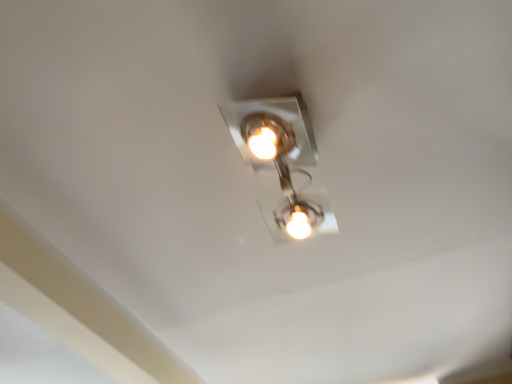
What do you see at coordinates (282, 162) in the screenshot? The image size is (512, 384). I see `matte silver lamp at center` at bounding box center [282, 162].

Image resolution: width=512 pixels, height=384 pixels. Find the location of `matte silver lamp at center`. matte silver lamp at center is located at coordinates (282, 162).

Measure the distance between point (298, 168) and camera.

Point (298, 168) is 1.02 meters from camera.

This screenshot has height=384, width=512. I want to click on matte silver lamp at center, so click(282, 162).